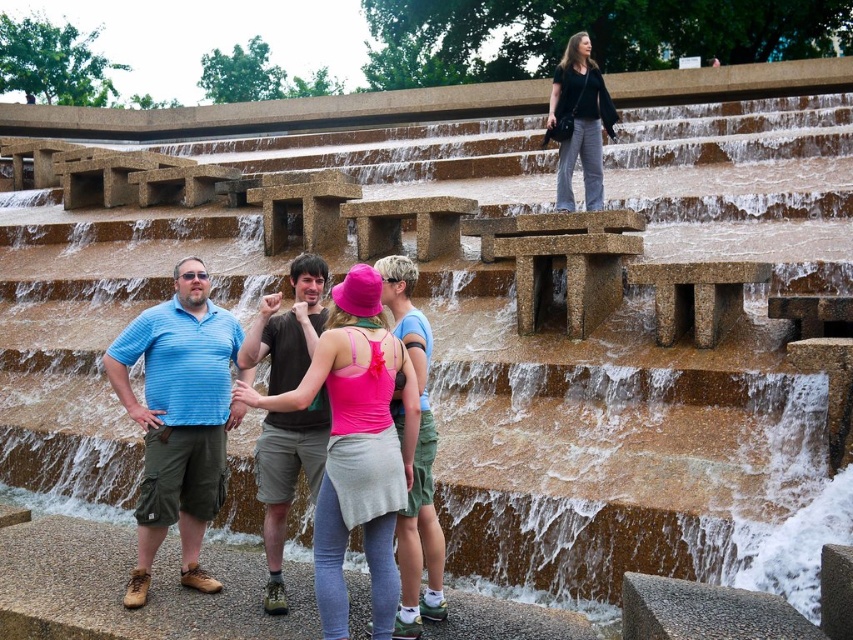
You are a photographer trying to capture a group photo of the pink fabric tank top at center and the black cotton shirt at upper right. If you want to ensure both subjects are in focus, which one should you adjust the camera focus on first?

The pink fabric tank top at center has a lesser width compared to black cotton shirt at upper right, so you should focus on the pink fabric tank top at center first to ensure both are in focus.

You are a photographer trying to capture a photo of the pink fabric hat at center and the black cotton shirt at upper right. Based on their sizes, which object should you zoom in more on to ensure both are clearly visible in the frame?

The pink fabric hat at center has a lesser width compared to the black cotton shirt at upper right, so you should zoom in more on the pink fabric hat at center to ensure both are clearly visible in the frame.